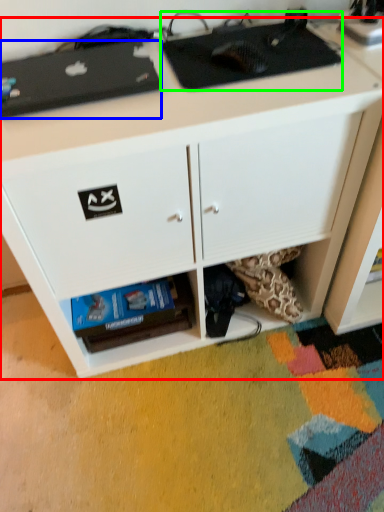
Question: Based on their relative distances, which object is nearer to desk (highlighted by a red box)? Choose from appliance (highlighted by a blue box) and appliance (highlighted by a green box).

Choices:
 (A) appliance
 (B) appliance

Answer: (B)